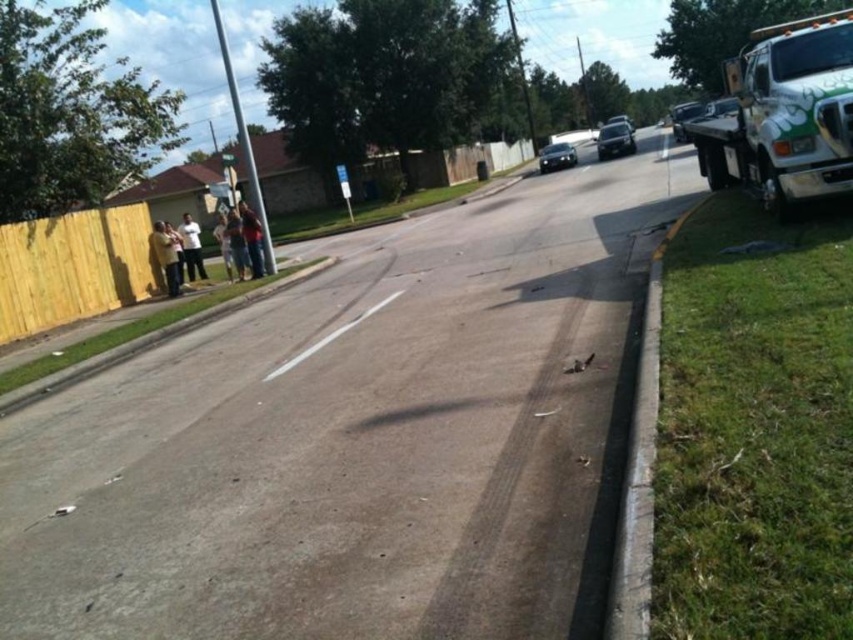
Question: Which point is closer to the camera taking this photo?

Choices:
 (A) (613, 134)
 (B) (544, 161)

Answer: (B)

Question: Where is white matte shirt at left located in relation to light brown fabric pants at left in the image?

Choices:
 (A) above
 (B) below

Answer: (A)

Question: Is shiny black car at center below light brown fabric pants at left?

Choices:
 (A) yes
 (B) no

Answer: (B)

Question: Can you confirm if shiny black car at center is wider than white matte shirt at left?

Choices:
 (A) no
 (B) yes

Answer: (B)

Question: Among these points, which one is nearest to the camera?

Choices:
 (A) (245, 208)
 (B) (553, 147)
 (C) (616, 145)

Answer: (A)

Question: Which point appears farthest from the camera in this image?

Choices:
 (A) (163, 248)
 (B) (844, 51)
 (C) (224, 268)

Answer: (C)